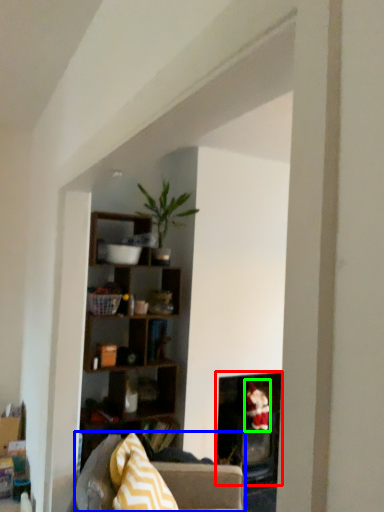
Question: Based on their relative distances, which object is farther from fireplace (highlighted by a red box)? Choose from studio couch (highlighted by a blue box) and toy (highlighted by a green box).

Choices:
 (A) studio couch
 (B) toy

Answer: (A)